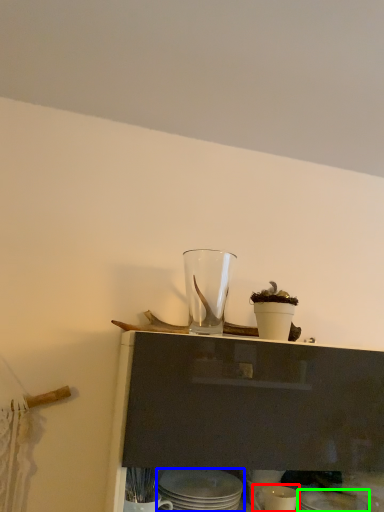
Question: Which object is positioned closest to tableware (highlighted by a red box)? Select from tableware (highlighted by a blue box) and tableware (highlighted by a green box).

Choices:
 (A) tableware
 (B) tableware

Answer: (B)